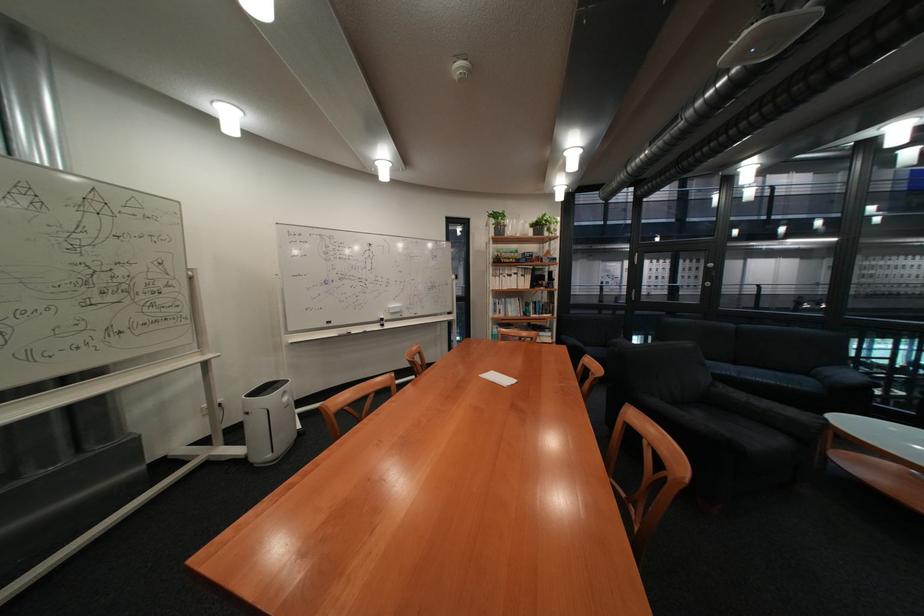
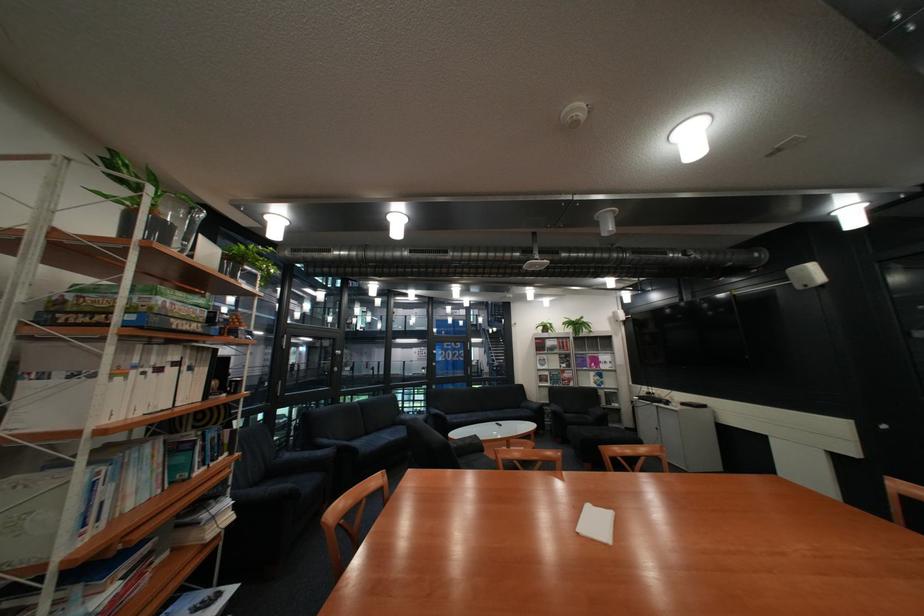
In the second image, find the point that corresponds to point (528, 301) in the first image.

(163, 448)